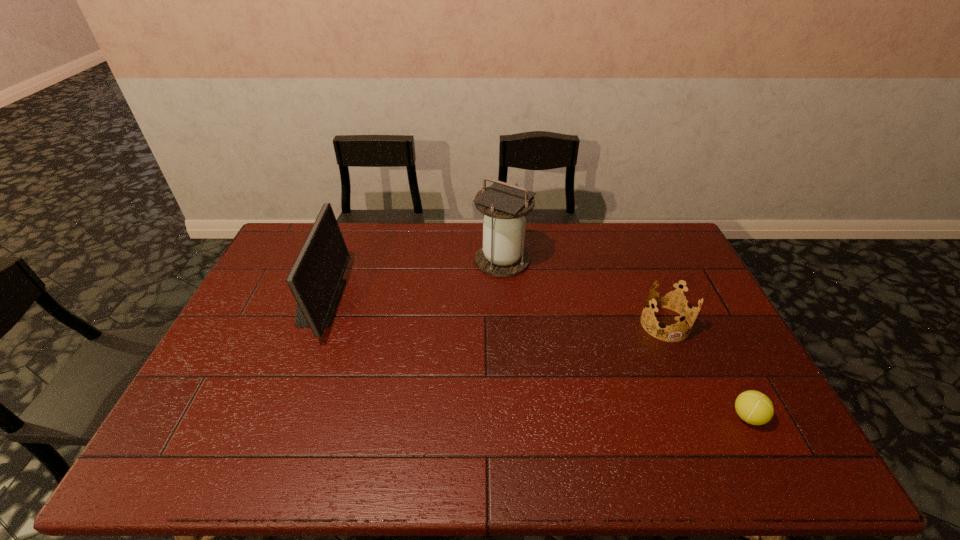
Where is `blank space that satisfies the following two spatial constraints: 1. on the screen side of the third shortest object; 2. on the left side of the tennis ball`? The width and height of the screenshot is (960, 540). blank space that satisfies the following two spatial constraints: 1. on the screen side of the third shortest object; 2. on the left side of the tennis ball is located at coordinates (274, 417).

Where is `free space in the image that satisfies the following two spatial constraints: 1. on the screen side of the third shortest object; 2. on the right side of the third tallest object`? free space in the image that satisfies the following two spatial constraints: 1. on the screen side of the third shortest object; 2. on the right side of the third tallest object is located at coordinates (310, 324).

At what (x,y) coordinates should I click in order to perform the action: click on vacant region that satisfies the following two spatial constraints: 1. on the screen side of the second shortest object; 2. on the right side of the leftmost object. Please return your answer as a coordinate pair (x, y). Looking at the image, I should click on (310, 324).

Image resolution: width=960 pixels, height=540 pixels. Find the location of `free space that satisfies the following two spatial constraints: 1. on the screen side of the third shortest object; 2. on the back side of the crown`. free space that satisfies the following two spatial constraints: 1. on the screen side of the third shortest object; 2. on the back side of the crown is located at coordinates (310, 324).

Image resolution: width=960 pixels, height=540 pixels. I want to click on vacant region that satisfies the following two spatial constraints: 1. on the screen side of the leftmost object; 2. on the left side of the tennis ball, so click(274, 417).

Identify the location of free location that satisfies the following two spatial constraints: 1. on the screen side of the tennis ball; 2. on the left side of the leftmost object. (274, 417).

Identify the location of vacant region that satisfies the following two spatial constraints: 1. on the screen side of the tennis ball; 2. on the right side of the third shortest object. (274, 417).

You are a GUI agent. You are given a task and a screenshot of the screen. Output one action in this format:
    pyautogui.click(x=<x>, y=<y>)
    Task: Click on the vacant position in the image that satisfies the following two spatial constraints: 1. on the front side of the shortest object; 2. on the right side of the second shortest object
    The width and height of the screenshot is (960, 540).
    Given the screenshot: What is the action you would take?
    pyautogui.click(x=705, y=417)

You are a GUI agent. You are given a task and a screenshot of the screen. Output one action in this format:
    pyautogui.click(x=<x>, y=<y>)
    Task: Click on the free point that satisfies the following two spatial constraints: 1. on the front side of the third object from right to left; 2. on the left side of the crown
    
    Given the screenshot: What is the action you would take?
    pyautogui.click(x=506, y=324)

Locate an element on the screen. vacant space that satisfies the following two spatial constraints: 1. on the front side of the tennis ball; 2. on the left side of the tallest object is located at coordinates (512, 417).